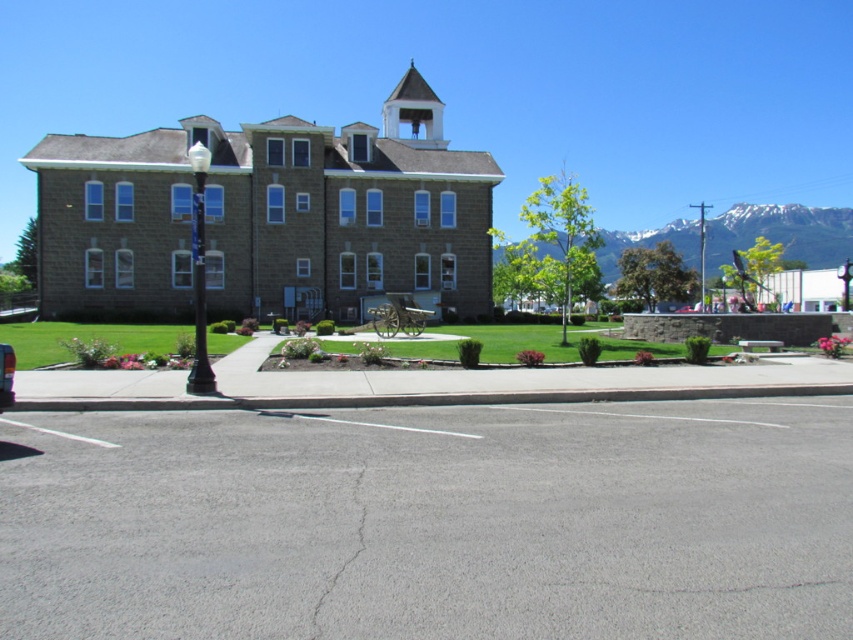
Question: Based on their relative distances, which object is farther from the white stucco bell tower at upper center?

Choices:
 (A) metallic silver car at lower left
 (B) snowy granite mountain at upper right
 (C) gray stone church at center
 (D) gray asphalt at lower center

Answer: (B)

Question: Estimate the real-world distances between objects in this image. Which object is closer to the snowy granite mountain at upper right?

Choices:
 (A) metallic silver car at lower left
 (B) gray asphalt at lower center

Answer: (B)

Question: Does snowy granite mountain at upper right come in front of white stucco bell tower at upper center?

Choices:
 (A) yes
 (B) no

Answer: (B)

Question: Which object is the farthest from the snowy granite mountain at upper right?

Choices:
 (A) white stucco bell tower at upper center
 (B) gray asphalt at lower center

Answer: (A)

Question: Does gray asphalt at lower center have a greater width compared to gray stone church at center?

Choices:
 (A) no
 (B) yes

Answer: (A)

Question: Observing the image, what is the correct spatial positioning of gray asphalt at lower center in reference to gray stone church at center?

Choices:
 (A) left
 (B) right

Answer: (B)